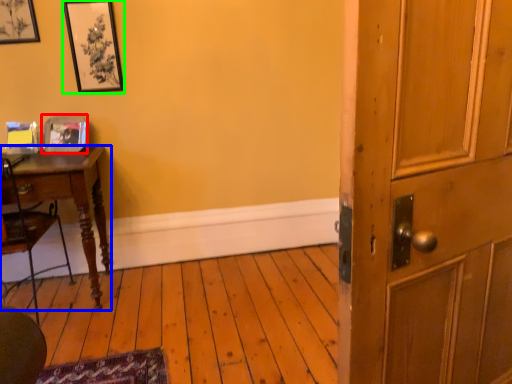
Question: Considering the real-world distances, which object is closest to picture frame (highlighted by a red box)? desk (highlighted by a blue box) or picture frame (highlighted by a green box).

Choices:
 (A) desk
 (B) picture frame

Answer: (A)